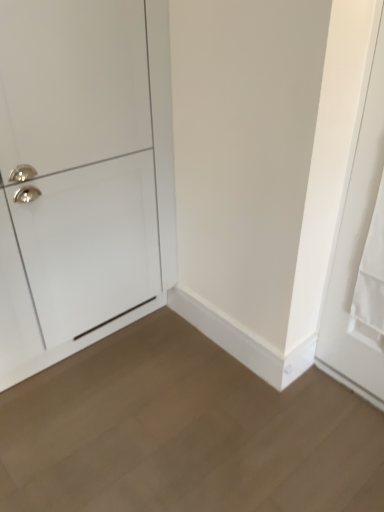
At what (x,y) coordinates should I click in order to perform the action: click on free location to the left of white matte door at right, the second door positioned from the left. Please return your answer as a coordinate pair (x, y). This screenshot has width=384, height=512. Looking at the image, I should click on pos(307,398).